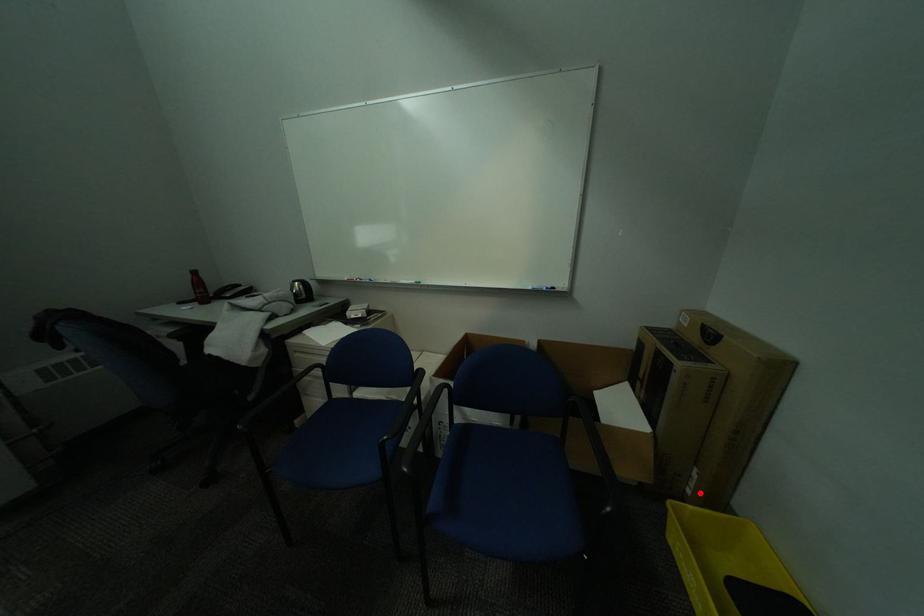
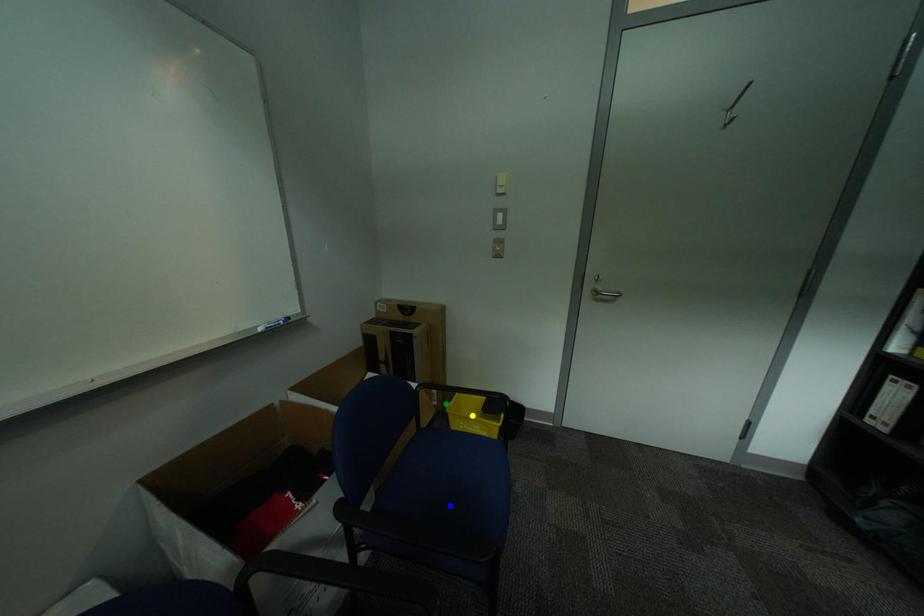
Question: I am providing you with two images of the same scene from different viewpoints. A red point is marked on the first image. You are given multiple points on the second image. Which mark in image 2 goes with the point in image 1?

Choices:
 (A) blue point
 (B) yellow point
 (C) green point

Answer: (C)